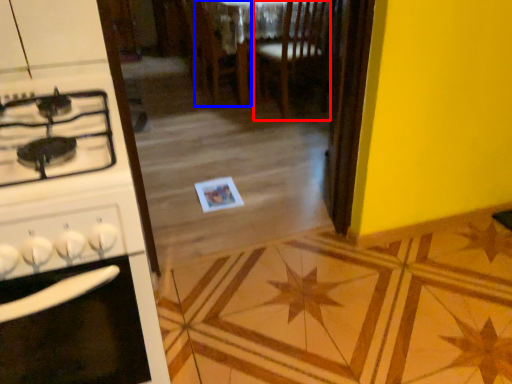
Question: Which of the following is the farthest to the observer, chair (highlighted by a red box) or chair (highlighted by a blue box)?

Choices:
 (A) chair
 (B) chair

Answer: (B)